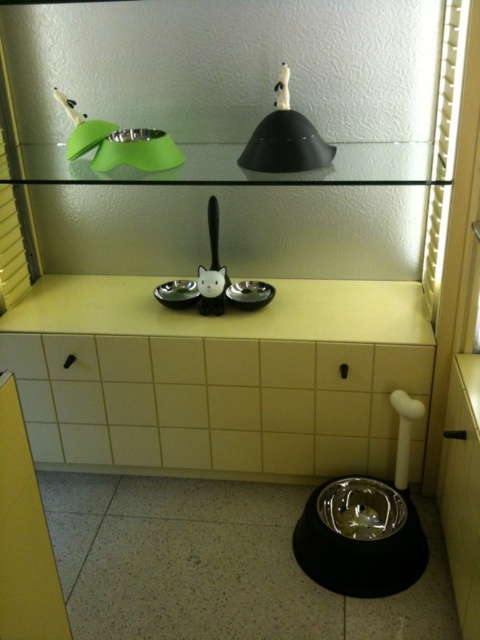
Where is `yellow matte counter top at center`? This screenshot has width=480, height=640. yellow matte counter top at center is located at coordinates (227, 314).

Based on the photo, which is more to the right, yellow matte counter top at center or black matte lampshade at upper center?

Positioned to the right is black matte lampshade at upper center.

What do you see at coordinates (227, 314) in the screenshot?
I see `yellow matte counter top at center` at bounding box center [227, 314].

I want to click on yellow matte counter top at center, so click(x=227, y=314).